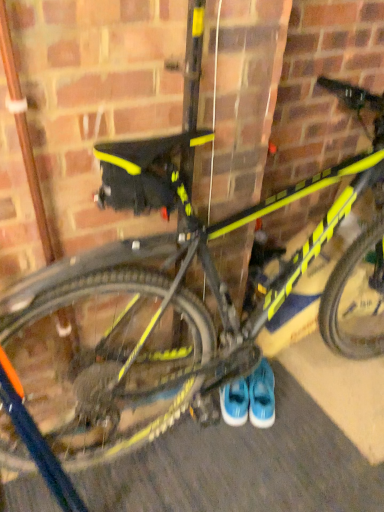
Where is `blank space above rubberized asphalt at lower center (from a real-world perspective)`? blank space above rubberized asphalt at lower center (from a real-world perspective) is located at coordinates pos(256,437).